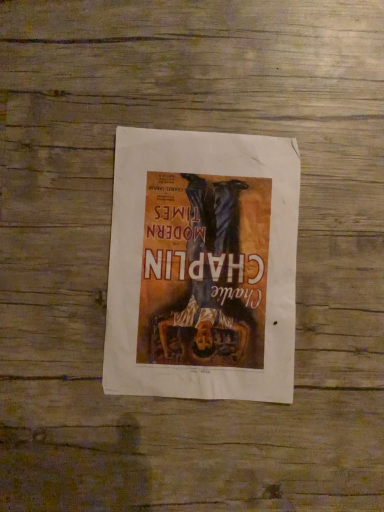
Find the location of a particular element. The width and height of the screenshot is (384, 512). vacant area on top of matte paper poster at center (from a real-world perspective) is located at coordinates (201, 262).